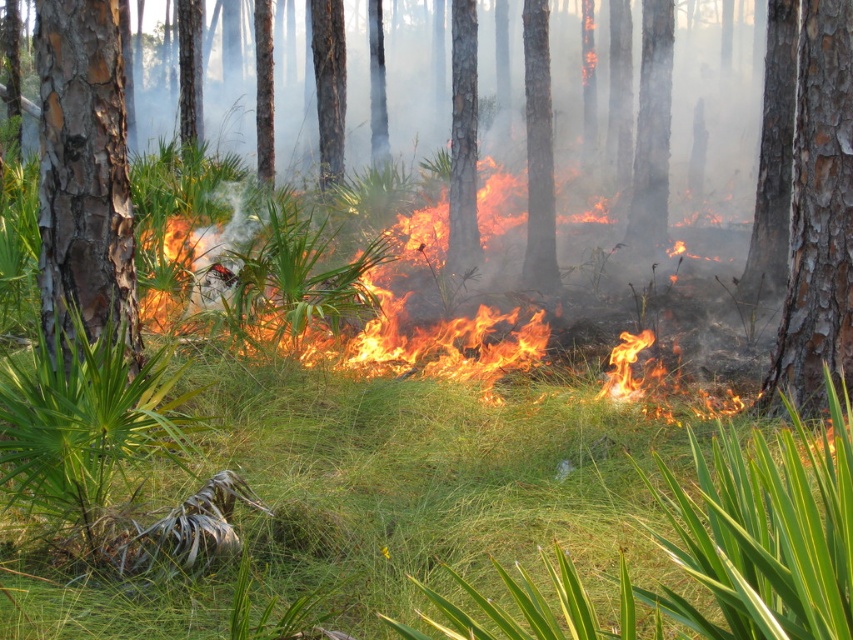
Question: Is green grass at center further to the viewer compared to smooth bark tree trunk at right?

Choices:
 (A) yes
 (B) no

Answer: (B)

Question: Does flaming grass at center have a lesser width compared to charcoal textured tree trunk at center?

Choices:
 (A) yes
 (B) no

Answer: (B)

Question: Observing the image, what is the correct spatial positioning of green grass at center in reference to smooth bark tree trunk at right?

Choices:
 (A) left
 (B) right

Answer: (A)

Question: Which object is the farthest from the charcoal textured tree trunk at center?

Choices:
 (A) green grass at center
 (B) flaming grass at center

Answer: (A)

Question: Which object appears closest to the camera in this image?

Choices:
 (A) charcoal textured tree trunk at center
 (B) smooth brown bark at left
 (C) green grass at center

Answer: (C)

Question: Which of the following is the farthest from the observer?

Choices:
 (A) (67, 348)
 (B) (312, 400)
 (C) (540, 93)
 (D) (813, 300)

Answer: (C)